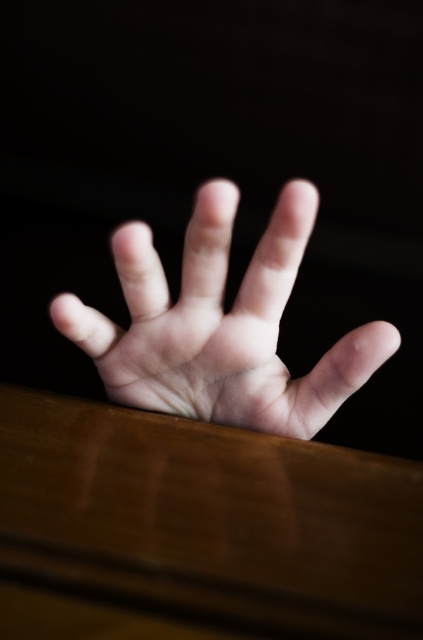
Question: Can you confirm if brown polished wood table at lower center is positioned to the left of pale skin hand at center?

Choices:
 (A) no
 (B) yes

Answer: (B)

Question: Is brown polished wood table at lower center below pale skin hand at center?

Choices:
 (A) no
 (B) yes

Answer: (B)

Question: Among these points, which one is farthest from the camera?

Choices:
 (A) (189, 308)
 (B) (140, 460)

Answer: (A)

Question: Is brown polished wood table at lower center smaller than pale skin hand at center?

Choices:
 (A) no
 (B) yes

Answer: (B)